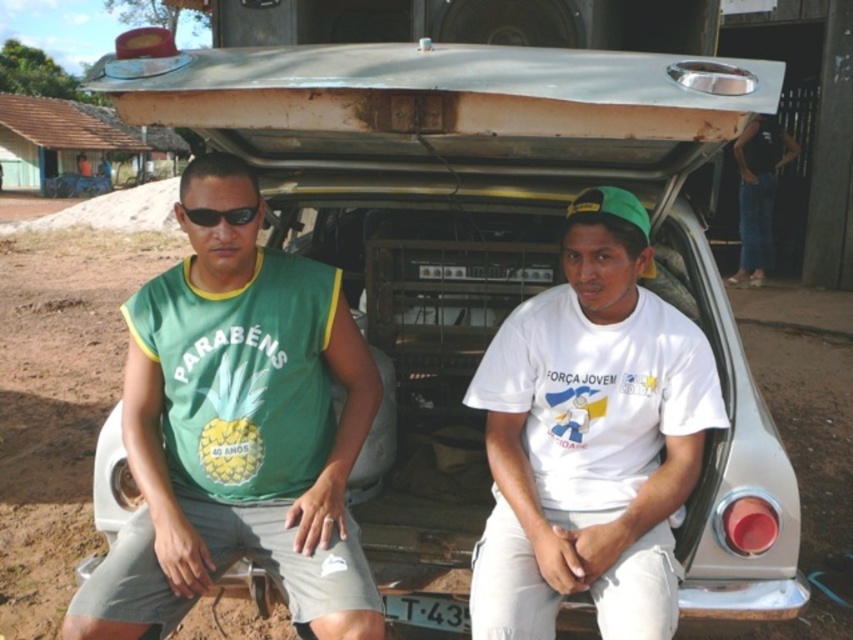
Question: Does jeans at right appear on the left side of black plastic sunglasses at left?

Choices:
 (A) yes
 (B) no

Answer: (B)

Question: Can you confirm if white matte t-shirt at center is wider than jeans at right?

Choices:
 (A) no
 (B) yes

Answer: (A)

Question: Is green fabric shirt at center to the left of black plastic sunglasses at left from the viewer's perspective?

Choices:
 (A) no
 (B) yes

Answer: (B)

Question: Which point is farther to the camera?

Choices:
 (A) green fabric shirt at center
 (B) black plastic sunglasses at left
 (C) white matte t-shirt at center

Answer: (B)

Question: Which point is farther from the camera taking this photo?

Choices:
 (A) (740, 224)
 (B) (369, 422)
 (C) (508, 625)

Answer: (A)

Question: Which is farther from the white matte t-shirt at center?

Choices:
 (A) black plastic sunglasses at left
 (B) green fabric shirt at center
 (C) jeans at right

Answer: (C)